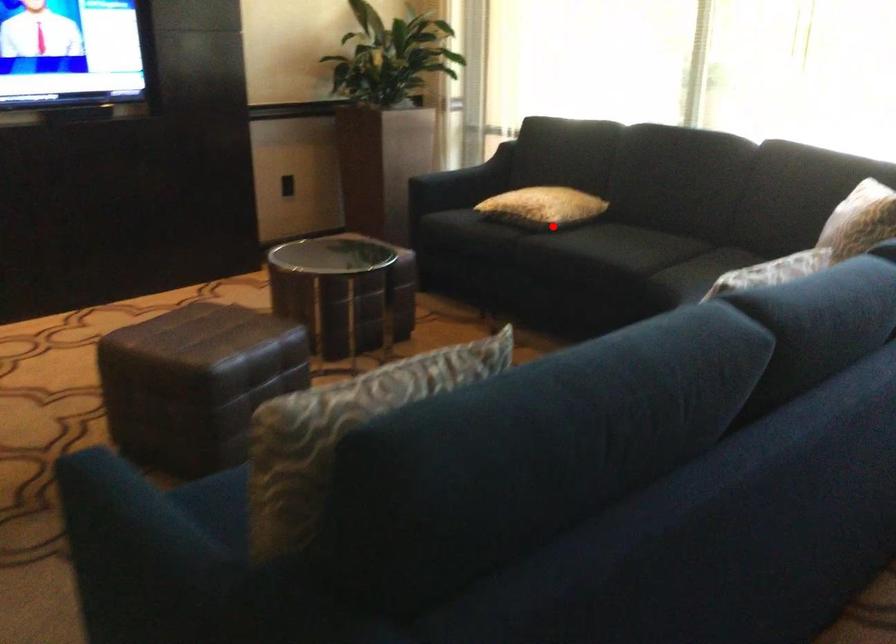
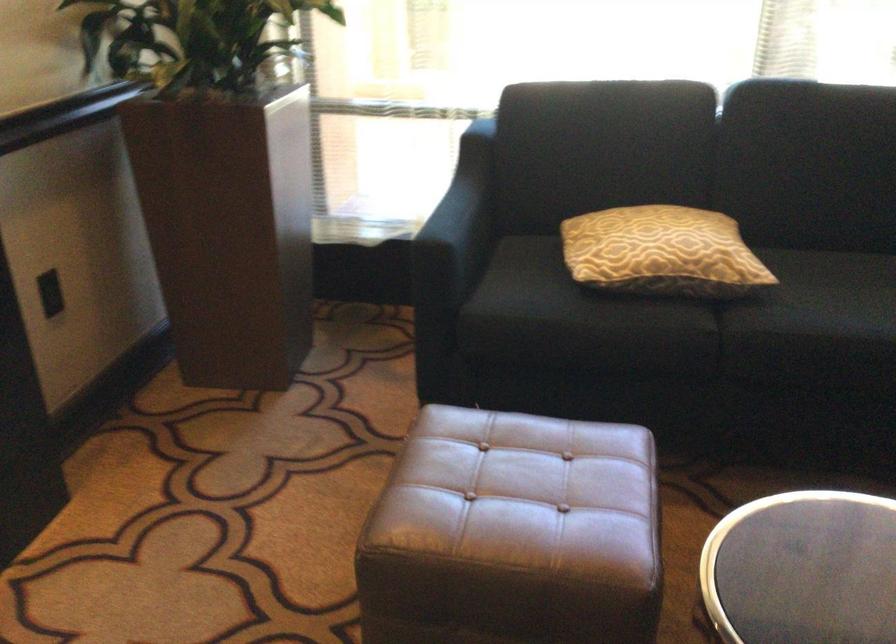
Question: A red point is marked in image1. In image2, is the corresponding 3D point closer to the camera or farther? Reply with the corresponding letter.

Choices:
 (A) The corresponding 3D point is closer.
 (B) The corresponding 3D point is farther.

Answer: (A)